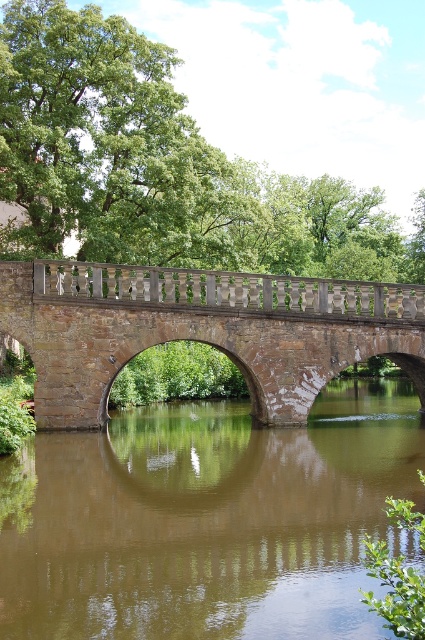
Question: Which object is farther from the camera taking this photo?

Choices:
 (A) brown stone bridge at center
 (B) brown smooth water at center

Answer: (A)

Question: Is the position of brown smooth water at center less distant than that of brown stone bridge at center?

Choices:
 (A) yes
 (B) no

Answer: (A)

Question: Does brown smooth water at center have a larger size compared to brown stone bridge at center?

Choices:
 (A) yes
 (B) no

Answer: (A)

Question: Is the position of brown smooth water at center more distant than that of brown stone bridge at center?

Choices:
 (A) no
 (B) yes

Answer: (A)